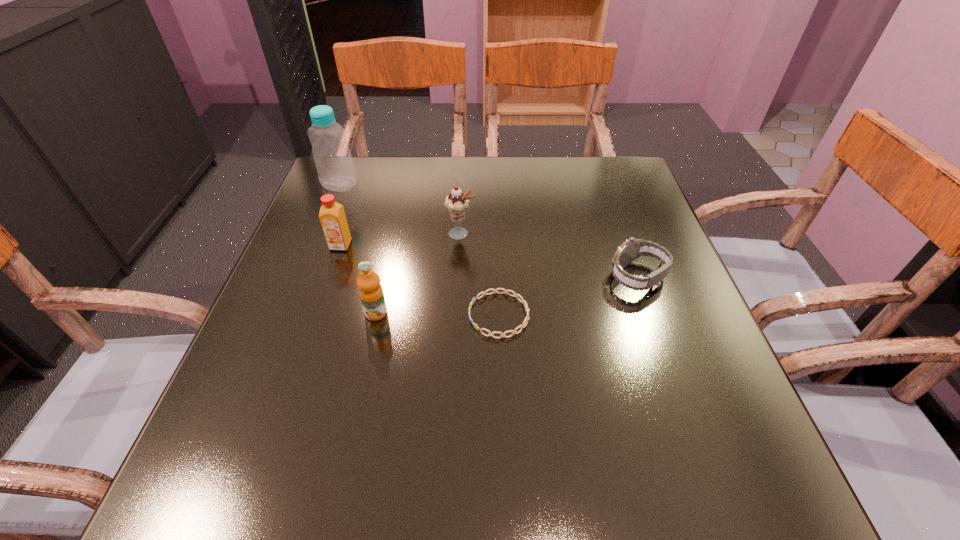
Locate an element on the screen. This screenshot has width=960, height=540. vacant space at the far right corner of the desktop is located at coordinates (589, 198).

This screenshot has height=540, width=960. In the image, there is a desktop. Find the location of `free space at the near right corner`. free space at the near right corner is located at coordinates (689, 492).

Image resolution: width=960 pixels, height=540 pixels. Identify the location of vacant space that is in between the second shortest object and the bracelet. (568, 296).

You are a GUI agent. You are given a task and a screenshot of the screen. Output one action in this format:
    pyautogui.click(x=<x>, y=<y>)
    Task: Click on the vacant area between the nearer orange juice and the watch
    This screenshot has width=960, height=540.
    Given the screenshot: What is the action you would take?
    pyautogui.click(x=507, y=295)

This screenshot has height=540, width=960. What are the coordinates of `free space between the tallest object and the bracelet` in the screenshot? It's located at (420, 249).

This screenshot has width=960, height=540. In order to click on free space between the icecream and the shortest object in this screenshot , I will do `click(480, 274)`.

Where is `empty space that is in between the watch and the bottle`? The height and width of the screenshot is (540, 960). empty space that is in between the watch and the bottle is located at coordinates (489, 231).

This screenshot has height=540, width=960. What are the coordinates of `free point between the bottle and the shortest object` in the screenshot? It's located at (420, 249).

You are a GUI agent. You are given a task and a screenshot of the screen. Output one action in this format:
    pyautogui.click(x=<x>, y=<y>)
    Task: Click on the free space between the second shortest object and the icecream
    
    Given the screenshot: What is the action you would take?
    pyautogui.click(x=550, y=255)

Where is `vacant region between the right orange juice and the watch`? This screenshot has height=540, width=960. vacant region between the right orange juice and the watch is located at coordinates (507, 295).